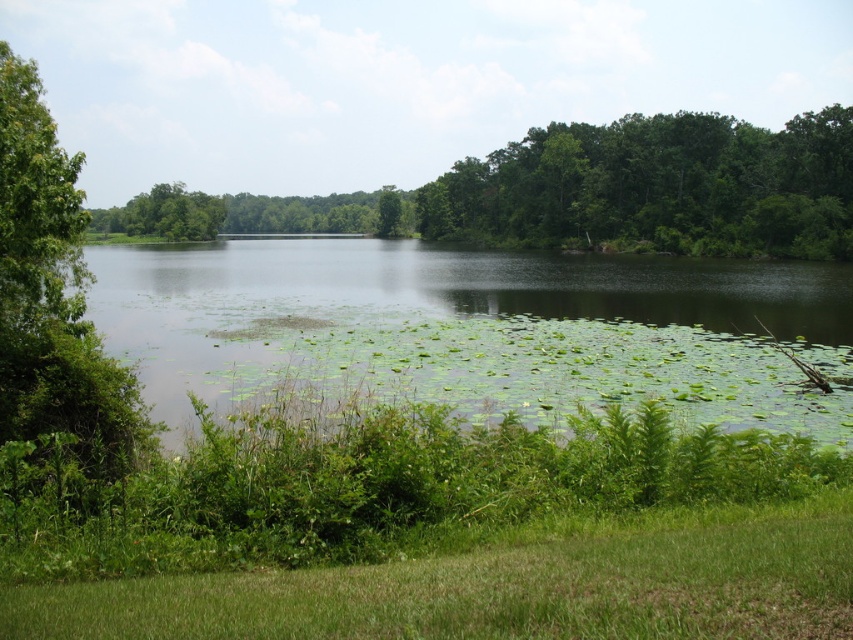
You are standing in the serene landscape described and want to know which object takes up more area in the scene. Which one is larger in size between the green leafy water at center and the green leafy tree at center?

The green leafy tree at center occupies more space than the green leafy water at center, so it is larger in size.

In the scene shown: You are standing at the center of the grassy area in the foreground. You want to walk towards the green leafy water at center. Which direction should you walk?

The green leafy water at center is located at point 0.516 on the x axis and 0.558 on the y axis. Since you are at the center of the grassy area, you should walk towards the upper direction to reach the green leafy water at center.

You are standing on the grassy area in the foreground and want to walk to the dense forest in the background. Which object, the green leafy water at center or the green leafy tree at center, would you encounter first?

The green leafy water at center is encountered first because its width is less than the green leafy tree at center, meaning it is closer to the observer.